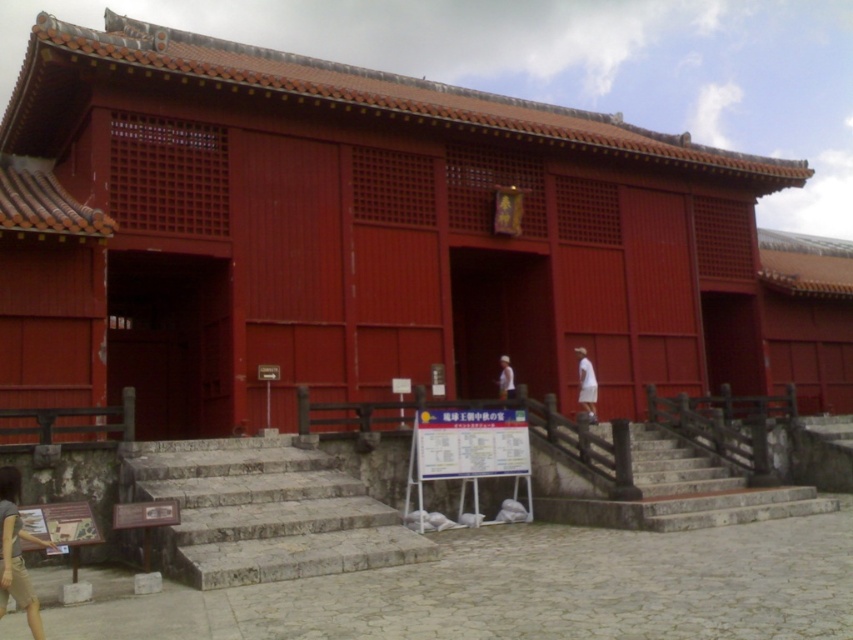
Which is more to the right, light brown fabric shorts at lower left or white fabric at right?

white fabric at right

Is the position of light brown fabric shorts at lower left more distant than that of white fabric at right?

That is False.

You are a GUI agent. You are given a task and a screenshot of the screen. Output one action in this format:
    pyautogui.click(x=<x>, y=<y>)
    Task: Click on the light brown fabric shorts at lower left
    The width and height of the screenshot is (853, 640).
    Given the screenshot: What is the action you would take?
    pyautogui.click(x=15, y=552)

Locate an element on the screen. This screenshot has height=640, width=853. light brown fabric shorts at lower left is located at coordinates (15, 552).

Looking at this image, is gray stone stairs at lower left below white fabric shirt at center?

Correct, gray stone stairs at lower left is located below white fabric shirt at center.

Is gray stone stairs at lower left behind white fabric shirt at center?

That is False.

This screenshot has height=640, width=853. Identify the location of gray stone stairs at lower left. (263, 513).

The width and height of the screenshot is (853, 640). In order to click on gray stone stairs at lower left in this screenshot , I will do `click(263, 513)`.

Which of these two, stone/stained at center or white fabric shirt at center, stands shorter?

With less height is white fabric shirt at center.

Is point (538, 458) less distant than point (502, 392)?

Yes, point (538, 458) is in front of point (502, 392).

Which is behind, point (680, 468) or point (498, 392)?

Point (498, 392)

Locate an element on the screen. stone/stained at center is located at coordinates (663, 490).